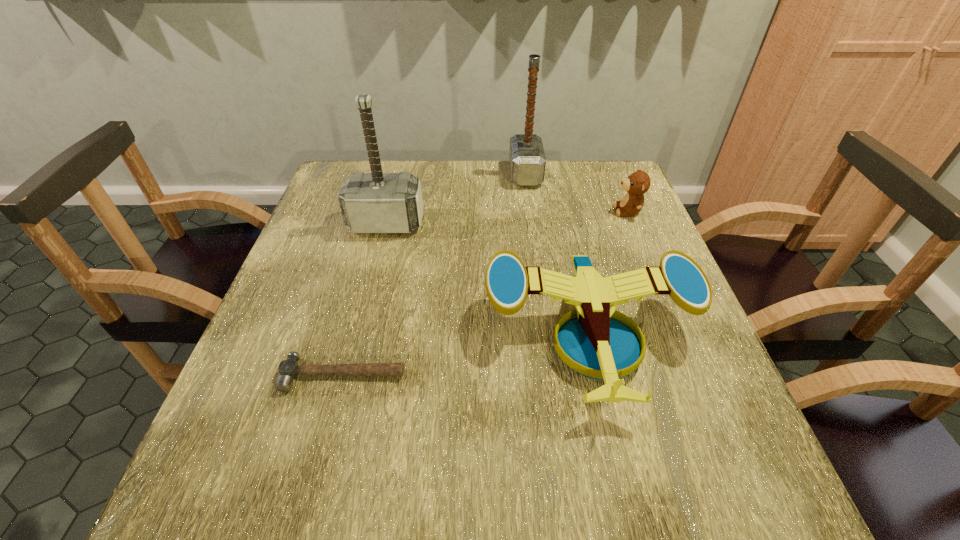
Where is `unoccupied position between the drone and the farthest hammer`? The height and width of the screenshot is (540, 960). unoccupied position between the drone and the farthest hammer is located at coordinates (558, 255).

Where is `vacant region between the teddy bear and the second farthest hammer`? The image size is (960, 540). vacant region between the teddy bear and the second farthest hammer is located at coordinates (507, 217).

Image resolution: width=960 pixels, height=540 pixels. In order to click on vacant area between the drone and the shortest hammer in this screenshot , I will do `click(467, 356)`.

Where is `vacant area between the second farthest hammer and the shortest object`? The image size is (960, 540). vacant area between the second farthest hammer and the shortest object is located at coordinates (365, 299).

What are the coordinates of `free space between the second nearest hammer and the farthest hammer` in the screenshot? It's located at (456, 199).

Image resolution: width=960 pixels, height=540 pixels. In order to click on free space between the second nearest hammer and the rightmost hammer in this screenshot , I will do `click(456, 199)`.

Where is `blank region between the shortest object and the second farthest hammer`? The height and width of the screenshot is (540, 960). blank region between the shortest object and the second farthest hammer is located at coordinates (365, 299).

The height and width of the screenshot is (540, 960). I want to click on free space that is in between the farthest object and the drone, so click(x=558, y=255).

Find the location of a particular element. The height and width of the screenshot is (540, 960). object that is the second closest to the nearest hammer is located at coordinates (376, 202).

At what (x,y) coordinates should I click in order to perform the action: click on object identified as the closest to the nearest hammer. Please return your answer as a coordinate pair (x, y). The height and width of the screenshot is (540, 960). Looking at the image, I should click on click(593, 344).